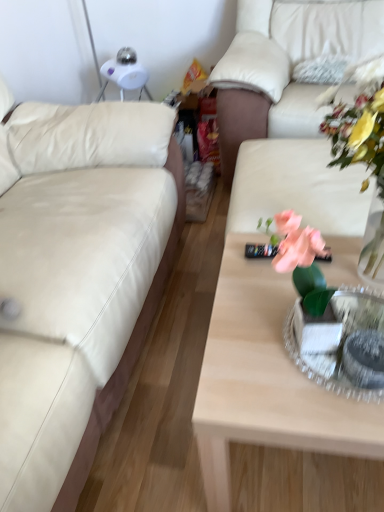
Locate an element on the screen. The height and width of the screenshot is (512, 384). free space that is to the left of translucent glass vase at upper right is located at coordinates (251, 287).